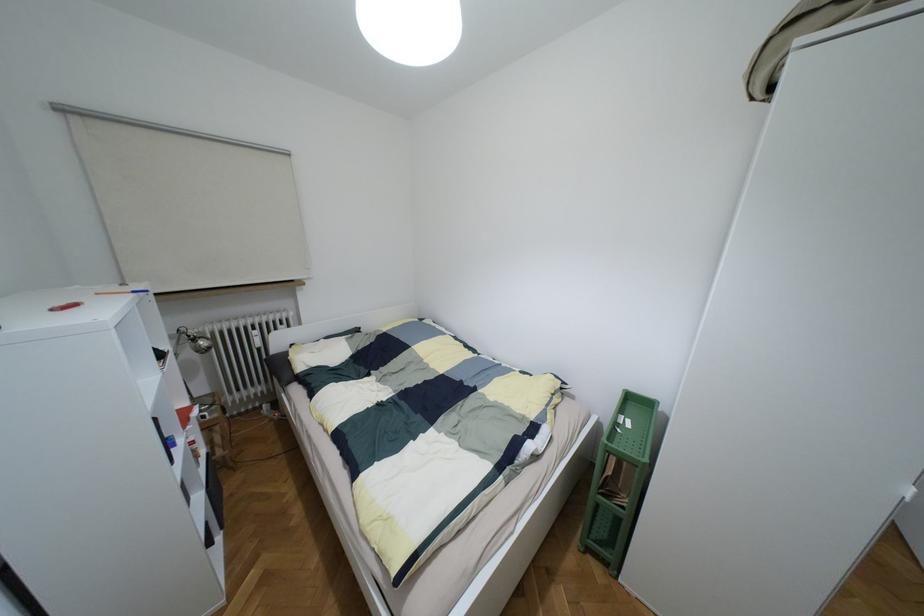
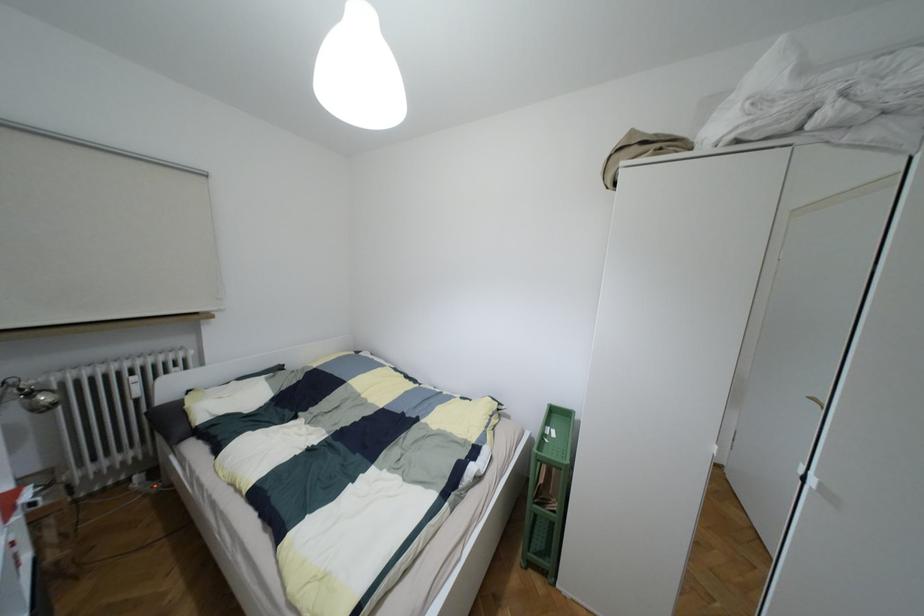
Question: How did the camera likely rotate?

Choices:
 (A) Left
 (B) Right
 (C) Up
 (D) Down

Answer: (B)